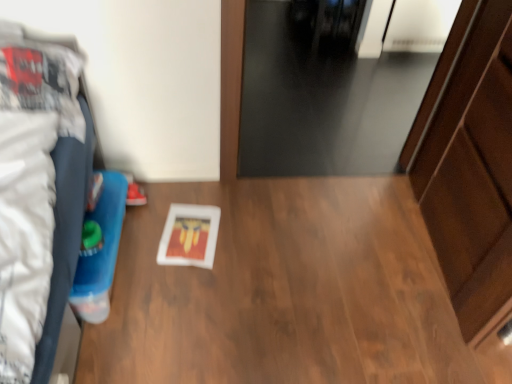
At what (x,y) coordinates should I click in order to perform the action: click on empty space that is ontop of wooden table at center. Please return your answer as a coordinate pair (x, y). Looking at the image, I should click on (261, 281).